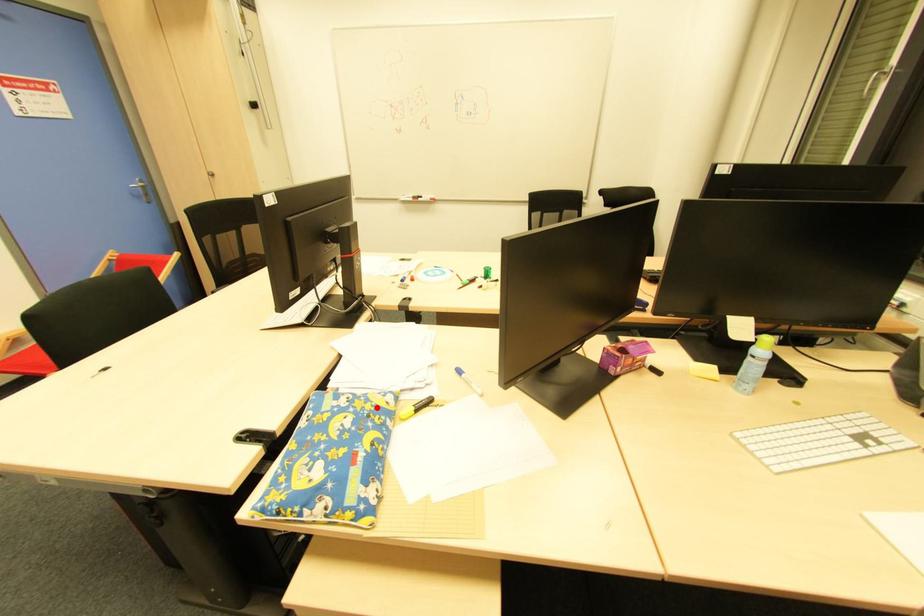
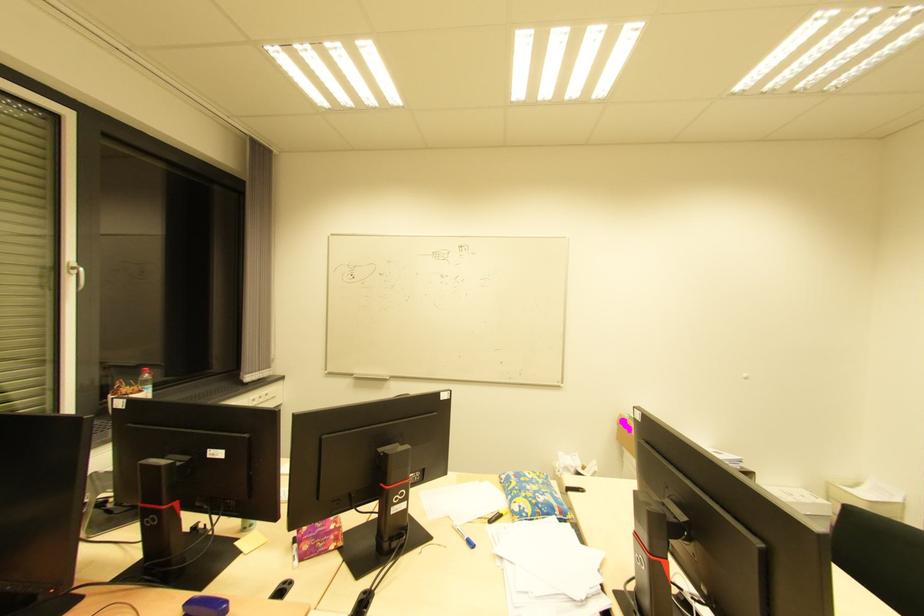
Question: I am providing you with two images of the same scene from different viewpoints. A red point is marked on the first image. At the location where the point appears in image 1, is it still visible in image 2?

Choices:
 (A) Yes
 (B) No

Answer: (A)